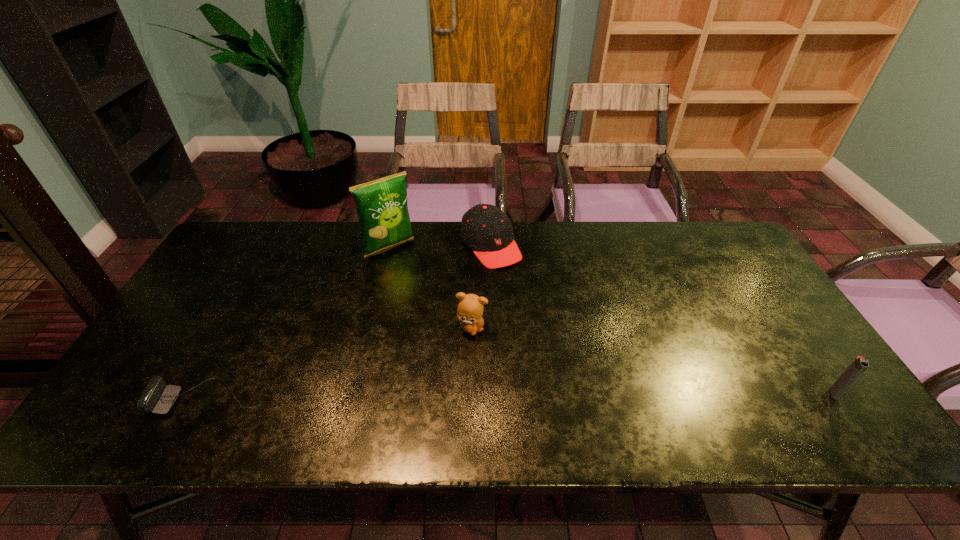
At what (x,y) coordinates should I click in order to perform the action: click on crisp (potato chip) present at the far edge. Please return your answer as a coordinate pair (x, y). The width and height of the screenshot is (960, 540). Looking at the image, I should click on (382, 208).

You are a GUI agent. You are given a task and a screenshot of the screen. Output one action in this format:
    pyautogui.click(x=<x>, y=<y>)
    Task: Click on the webcam that is at the near edge
    Image resolution: width=960 pixels, height=540 pixels.
    Given the screenshot: What is the action you would take?
    pyautogui.click(x=155, y=398)

I want to click on igniter that is at the near edge, so click(x=859, y=364).

The height and width of the screenshot is (540, 960). In order to click on object located in the left edge section of the desktop in this screenshot , I will do `click(155, 398)`.

Identify the location of object present at the right edge. (859, 364).

Image resolution: width=960 pixels, height=540 pixels. I want to click on object that is at the near left corner, so click(x=155, y=398).

At what (x,y) coordinates should I click in order to perform the action: click on object positioned at the near right corner. Please return your answer as a coordinate pair (x, y). The height and width of the screenshot is (540, 960). Looking at the image, I should click on (859, 364).

Locate an element on the screen. vacant space at the far edge is located at coordinates (528, 261).

I want to click on free space at the near edge, so click(x=413, y=377).

The image size is (960, 540). I want to click on vacant region at the left edge of the desktop, so click(x=179, y=320).